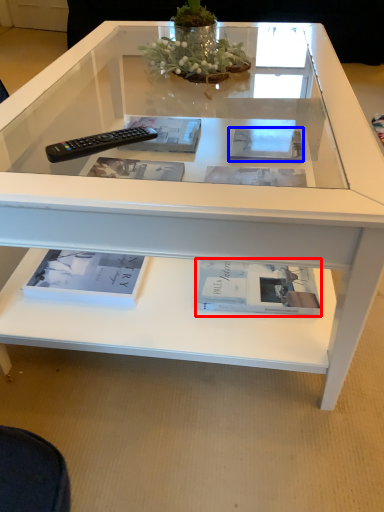
Question: Which point is further to the camera, book (highlighted by a red box) or magazine (highlighted by a blue box)?

Choices:
 (A) book
 (B) magazine

Answer: (B)